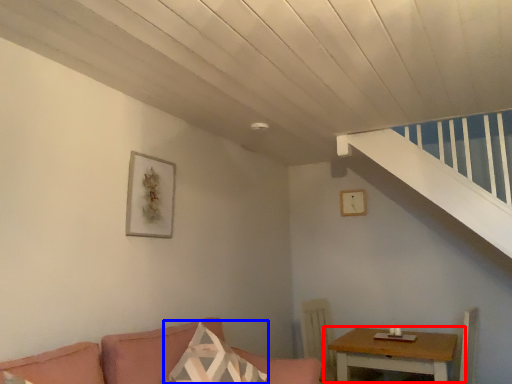
Question: Which object appears farthest to the camera in this image, table (highlighted by a red box) or pillow (highlighted by a blue box)?

Choices:
 (A) table
 (B) pillow

Answer: (A)